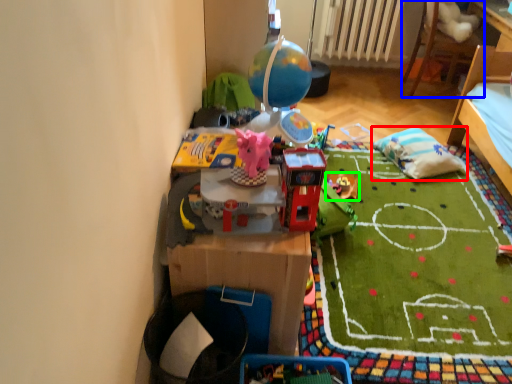
Question: Estimate the real-world distances between objects in this image. Which object is farther from pillow (highlighted by a red box), furniture (highlighted by a blue box) or toy (highlighted by a green box)?

Choices:
 (A) furniture
 (B) toy

Answer: (A)